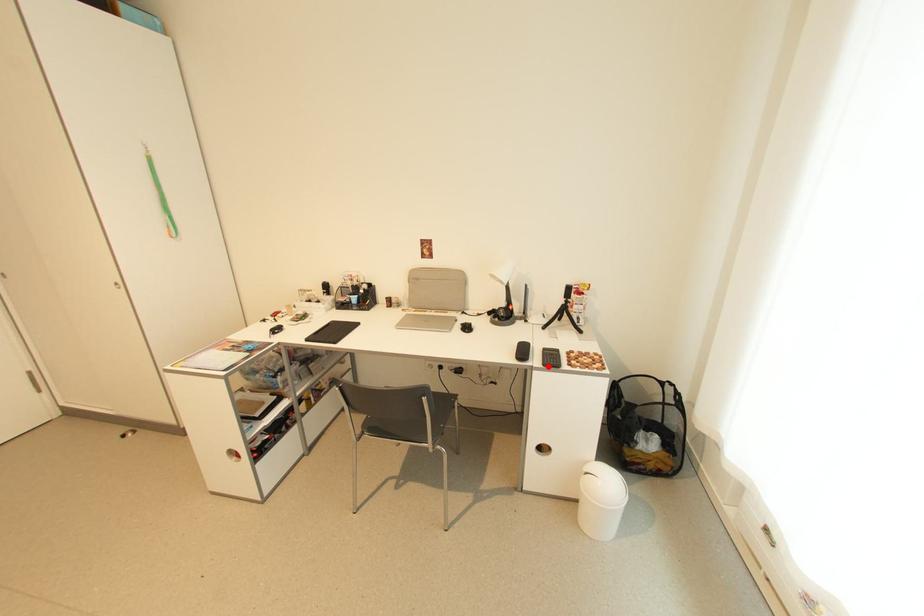
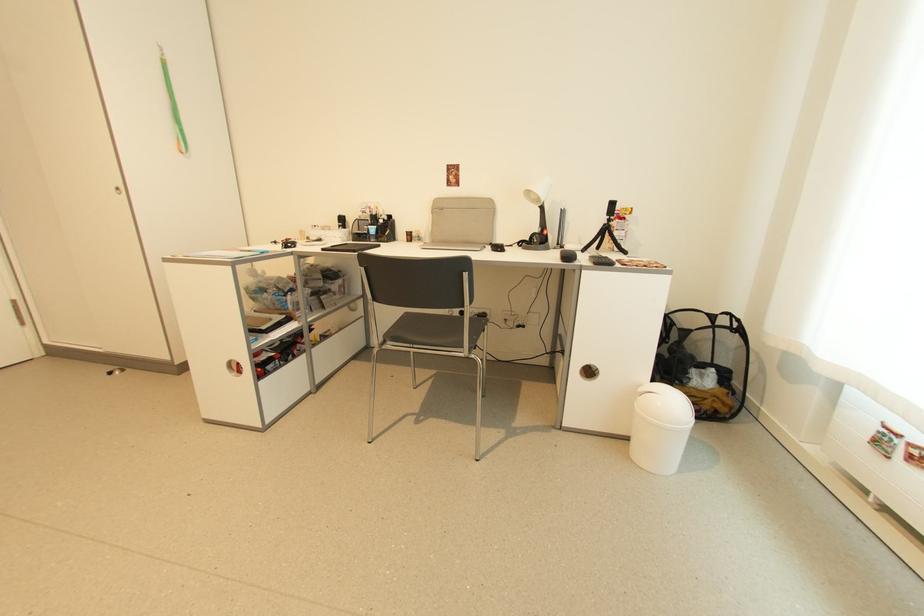
Find the pixel in the second image that matches the highlighted location in the first image.

(600, 265)